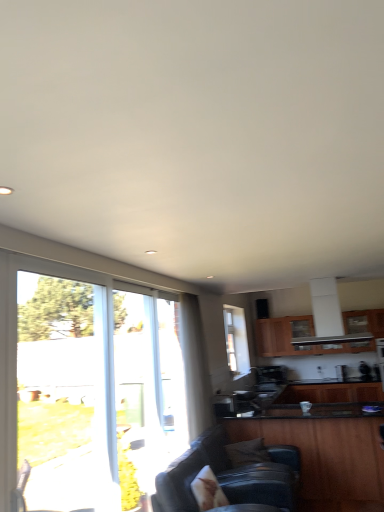
How much space does clear glass window at center, arranged as the 2th window when viewed from the left, occupy vertically?

It is 3.63 feet.

Locate an element on the screen. The width and height of the screenshot is (384, 512). clear glass window at center, marked as the 2th window in a front-to-back arrangement is located at coordinates (230, 339).

Where is `clear glass window at left, which appears as the second window when viewed from the back`? The width and height of the screenshot is (384, 512). clear glass window at left, which appears as the second window when viewed from the back is located at coordinates (86, 388).

This screenshot has width=384, height=512. What do you see at coordinates (230, 476) in the screenshot?
I see `leather couch at lower center` at bounding box center [230, 476].

Image resolution: width=384 pixels, height=512 pixels. Describe the element at coordinates (316, 337) in the screenshot. I see `wooden cabinet at upper center, which is the third cabinetry from front to back` at that location.

Locate an element on the screen. clear glass window at center, which is the 1th window from right to left is located at coordinates (230, 339).

Considering the points (262, 436) and (291, 355), which point is behind, point (262, 436) or point (291, 355)?

Point (291, 355)

From a real-world perspective, is wooden cabinet at lower right, marked as the 1th cabinetry in a front-to-back arrangement, physically located above or below wooden cabinet at upper center, which is the third cabinetry from front to back?

From a real-world perspective, wooden cabinet at lower right, marked as the 1th cabinetry in a front-to-back arrangement, is physically below wooden cabinet at upper center, which is the third cabinetry from front to back.

Are wooden cabinet at lower right, marked as the 1th cabinetry in a front-to-back arrangement, and wooden cabinet at upper center, which is the third cabinetry from front to back, beside each other?

No, wooden cabinet at lower right, marked as the 1th cabinetry in a front-to-back arrangement, is not making contact with wooden cabinet at upper center, which is the third cabinetry from front to back.

Looking at this image, who is smaller, wooden cabinet at lower right, which ranks as the third cabinetry in back-to-front order, or wooden cabinet at upper center, the first cabinetry viewed from the back?

With smaller size is wooden cabinet at upper center, the first cabinetry viewed from the back.

Which object is more forward, clear glass window at center, the first window positioned from the back, or clear glass window at left, the first window viewed from the left?

clear glass window at left, the first window viewed from the left.

Which is behind, point (229, 308) or point (16, 279)?

Point (229, 308)

Which of these two, clear glass window at center, which is the 1th window from right to left, or clear glass window at left, the first window viewed from the left, is smaller?

With smaller size is clear glass window at center, which is the 1th window from right to left.

The width and height of the screenshot is (384, 512). I want to click on cabinetry that is under the wooden cabinet at lower right, the second cabinetry viewed from the back (from a real-world perspective), so click(325, 452).

From the image's perspective, is wooden cabinet at lower right, marked as the 1th cabinetry in a front-to-back arrangement, located above or below wooden cabinet at lower right, which is the second cabinetry in front-to-back order?

From the image's perspective, wooden cabinet at lower right, marked as the 1th cabinetry in a front-to-back arrangement, appears above wooden cabinet at lower right, which is the second cabinetry in front-to-back order.

Between wooden cabinet at lower right, which ranks as the third cabinetry in back-to-front order, and wooden cabinet at lower right, which is the second cabinetry in front-to-back order, which one has larger size?

wooden cabinet at lower right, which ranks as the third cabinetry in back-to-front order.

Would you consider wooden cabinet at lower right, marked as the 1th cabinetry in a front-to-back arrangement, to be distant from wooden cabinet at lower right, the second cabinetry viewed from the back?

wooden cabinet at lower right, marked as the 1th cabinetry in a front-to-back arrangement, is far away from wooden cabinet at lower right, the second cabinetry viewed from the back.

Is wooden cabinet at lower right, the second cabinetry viewed from the back, taller than clear glass window at left, which appears as the second window when viewed from the back?

No, wooden cabinet at lower right, the second cabinetry viewed from the back, is not taller than clear glass window at left, which appears as the second window when viewed from the back.

Is wooden cabinet at lower right, which is the second cabinetry in front-to-back order, inside the boundaries of clear glass window at left, acting as the 1th window starting from the front, or outside?

wooden cabinet at lower right, which is the second cabinetry in front-to-back order, is outside clear glass window at left, acting as the 1th window starting from the front.

From a real-world perspective, is wooden cabinet at lower right, the second cabinetry viewed from the back, above or below clear glass window at left, the first window viewed from the left?

From a real-world perspective, wooden cabinet at lower right, the second cabinetry viewed from the back, is physically below clear glass window at left, the first window viewed from the left.

Is wooden cabinet at upper center, the first cabinetry viewed from the back, outside of clear glass window at left, which appears as the second window when viewed from the back?

wooden cabinet at upper center, the first cabinetry viewed from the back, is positioned outside clear glass window at left, which appears as the second window when viewed from the back.

Which is more to the right, wooden cabinet at upper center, the first cabinetry viewed from the back, or clear glass window at left, placed as the 2th window when sorted from right to left?

wooden cabinet at upper center, the first cabinetry viewed from the back.

Is wooden cabinet at upper center, which is the third cabinetry from front to back, next to clear glass window at left, the first window viewed from the left, and touching it?

No, wooden cabinet at upper center, which is the third cabinetry from front to back, is not with clear glass window at left, the first window viewed from the left.

Is point (343, 350) less distant than point (141, 505)?

That is False.

Which is in front, leather couch at lower center or wooden cabinet at lower right, the second cabinetry viewed from the back?

Positioned in front is leather couch at lower center.

In terms of height, does leather couch at lower center look taller or shorter compared to wooden cabinet at lower right, which is the second cabinetry in front-to-back order?

Clearly, leather couch at lower center is taller compared to wooden cabinet at lower right, which is the second cabinetry in front-to-back order.

This screenshot has height=512, width=384. Identify the location of studio couch in front of the wooden cabinet at lower right, which is the second cabinetry in front-to-back order. (230, 476).

Which object is thinner, leather couch at lower center or wooden cabinet at lower right, which is the second cabinetry in front-to-back order?

With smaller width is wooden cabinet at lower right, which is the second cabinetry in front-to-back order.

Between wooden cabinet at upper center, the first cabinetry viewed from the back, and clear glass window at center, the first window positioned from the back, which one has larger width?

wooden cabinet at upper center, the first cabinetry viewed from the back, is wider.

Does wooden cabinet at upper center, which is the third cabinetry from front to back, appear on the right side of clear glass window at center, marked as the 2th window in a front-to-back arrangement?

Yes, wooden cabinet at upper center, which is the third cabinetry from front to back, is to the right of clear glass window at center, marked as the 2th window in a front-to-back arrangement.

Is wooden cabinet at upper center, which is the third cabinetry from front to back, situated inside clear glass window at center, arranged as the 2th window when viewed from the left, or outside?

wooden cabinet at upper center, which is the third cabinetry from front to back, is located beyond the bounds of clear glass window at center, arranged as the 2th window when viewed from the left.

From a real-world perspective, is wooden cabinet at upper center, which is the third cabinetry from front to back, under clear glass window at center, which is the 1th window from right to left?

Indeed, from a real-world perspective, wooden cabinet at upper center, which is the third cabinetry from front to back, is positioned beneath clear glass window at center, which is the 1th window from right to left.

At what (x,y) coordinates should I click in order to perform the action: click on the 1st cabinetry below the wooden cabinet at upper center, the first cabinetry viewed from the back (from the image's perspective). Please return your answer as a coordinate pair (x, y). The height and width of the screenshot is (512, 384). Looking at the image, I should click on (325, 452).

In order to click on window below the clear glass window at center, arranged as the 2th window when viewed from the left (from a real-world perspective) in this screenshot , I will do `click(86, 388)`.

In the scene shown: Which object lies nearer to the anchor point wooden cabinet at lower right, which is the second cabinetry in front-to-back order, clear glass window at left, acting as the 1th window starting from the front, or wooden cabinet at upper center, the first cabinetry viewed from the back?

wooden cabinet at upper center, the first cabinetry viewed from the back.

When comparing their distances from clear glass window at center, arranged as the 2th window when viewed from the left, does wooden cabinet at upper center, the first cabinetry viewed from the back, or wooden cabinet at lower right, the second cabinetry viewed from the back, seem further?

The object further to clear glass window at center, arranged as the 2th window when viewed from the left, is wooden cabinet at lower right, the second cabinetry viewed from the back.

From the image, which object appears to be nearer to wooden cabinet at lower right, which is the second cabinetry in front-to-back order, leather couch at lower center or wooden cabinet at lower right, marked as the 1th cabinetry in a front-to-back arrangement?

The object closer to wooden cabinet at lower right, which is the second cabinetry in front-to-back order, is wooden cabinet at lower right, marked as the 1th cabinetry in a front-to-back arrangement.

Looking at the image, which one is located further to clear glass window at center, the first window positioned from the back, leather couch at lower center or wooden cabinet at upper center, which is the third cabinetry from front to back?

leather couch at lower center.

Consider the image. Based on their spatial positions, is clear glass window at center, the first window positioned from the back, or wooden cabinet at lower right, which ranks as the third cabinetry in back-to-front order, closer to wooden cabinet at lower right, which is the second cabinetry in front-to-back order?

Among the two, clear glass window at center, the first window positioned from the back, is located nearer to wooden cabinet at lower right, which is the second cabinetry in front-to-back order.

Based on their spatial positions, is leather couch at lower center or wooden cabinet at lower right, which ranks as the third cabinetry in back-to-front order, further from clear glass window at center, which is the 1th window from right to left?

Among the two, leather couch at lower center is located further to clear glass window at center, which is the 1th window from right to left.

Considering their positions, is leather couch at lower center positioned further to wooden cabinet at lower right, the second cabinetry viewed from the back, than clear glass window at center, arranged as the 2th window when viewed from the left?

leather couch at lower center is further to wooden cabinet at lower right, the second cabinetry viewed from the back.

Looking at the image, which one is located further to leather couch at lower center, clear glass window at left, the first window viewed from the left, or wooden cabinet at upper center, the first cabinetry viewed from the back?

wooden cabinet at upper center, the first cabinetry viewed from the back.

Locate an element on the screen. cabinetry between wooden cabinet at lower right, which ranks as the third cabinetry in back-to-front order, and clear glass window at center, the first window positioned from the back, in the front-back direction is located at coordinates (331, 393).

Where is `studio couch positioned between clear glass window at left, which appears as the second window when viewed from the back, and wooden cabinet at upper center, which is the third cabinetry from front to back, from near to far`? The image size is (384, 512). studio couch positioned between clear glass window at left, which appears as the second window when viewed from the back, and wooden cabinet at upper center, which is the third cabinetry from front to back, from near to far is located at coordinates (230, 476).

Find the location of `studio couch located between clear glass window at left, the first window viewed from the left, and wooden cabinet at lower right, which ranks as the third cabinetry in back-to-front order, in the left-right direction`. studio couch located between clear glass window at left, the first window viewed from the left, and wooden cabinet at lower right, which ranks as the third cabinetry in back-to-front order, in the left-right direction is located at coordinates (230, 476).

Where is `cabinetry located between clear glass window at left, placed as the 2th window when sorted from right to left, and wooden cabinet at lower right, the second cabinetry viewed from the back, in the depth direction`? This screenshot has height=512, width=384. cabinetry located between clear glass window at left, placed as the 2th window when sorted from right to left, and wooden cabinet at lower right, the second cabinetry viewed from the back, in the depth direction is located at coordinates (325, 452).